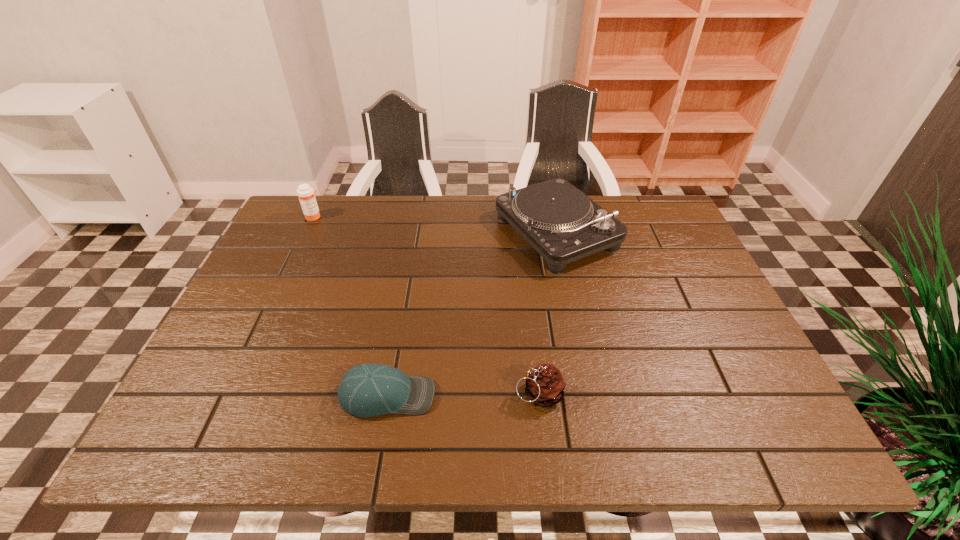
I want to click on record player, so click(x=559, y=221).

I want to click on the leftmost object, so click(306, 194).

The width and height of the screenshot is (960, 540). I want to click on pinecone, so click(545, 385).

You are a GUI agent. You are given a task and a screenshot of the screen. Output one action in this format:
    pyautogui.click(x=<x>, y=<y>)
    Task: Click on the shortest object
    The image size is (960, 540).
    Given the screenshot: What is the action you would take?
    pyautogui.click(x=371, y=389)

The width and height of the screenshot is (960, 540). Identify the location of the third object from right to left. (371, 389).

Locate an element on the screen. The height and width of the screenshot is (540, 960). free region located on the left of the record player is located at coordinates (439, 232).

At what (x,y) coordinates should I click in order to perform the action: click on vacant space located 0.100m on the front of the leftmost object. Please return your answer as a coordinate pair (x, y). Looking at the image, I should click on (302, 242).

Where is `vacant space located with a leaf charm attached to the third tallest object`? The width and height of the screenshot is (960, 540). vacant space located with a leaf charm attached to the third tallest object is located at coordinates (348, 394).

Identify the location of free point located with a leaf charm attached to the third tallest object. Image resolution: width=960 pixels, height=540 pixels. (490, 394).

Image resolution: width=960 pixels, height=540 pixels. In order to click on vacant space located 0.340m with a leaf charm attached to the third tallest object in this screenshot , I will do `click(348, 394)`.